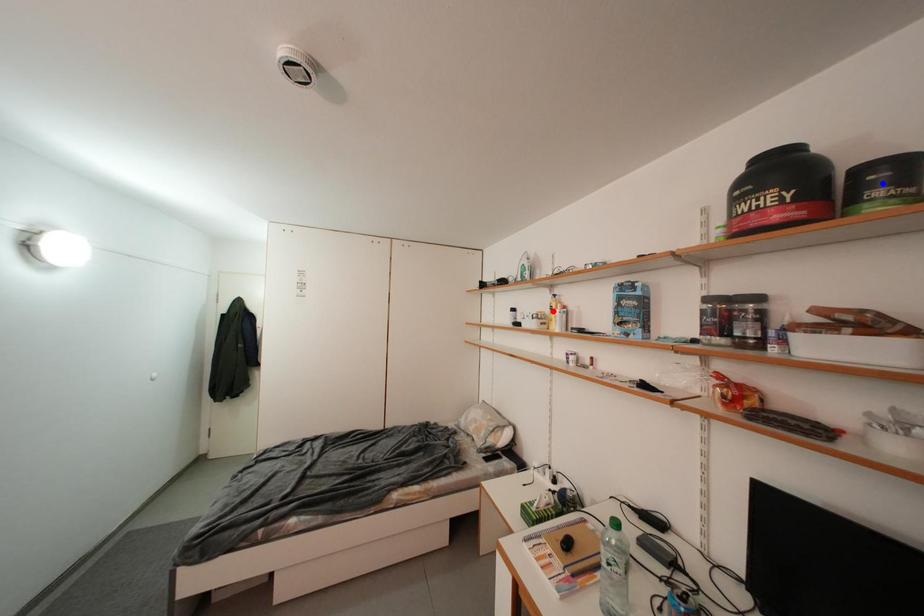
Question: In the image, two points are highlighted. Which point is nearer to the camera? Reply with the corresponding letter.

Choices:
 (A) blue point
 (B) red point

Answer: (A)